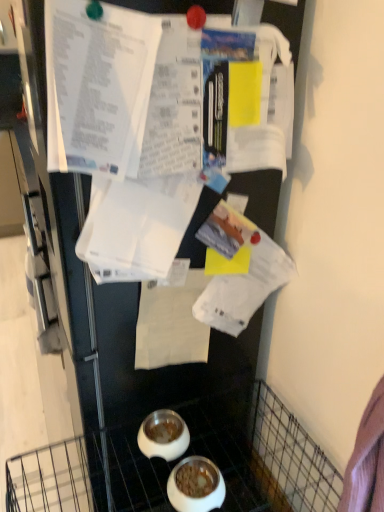
Question: Would you consider white paper at center to be distant from white glossy bowl at lower center, arranged as the 2th bowl when viewed from the back?

Choices:
 (A) yes
 (B) no

Answer: (B)

Question: Is white paper at center to the right of white glossy bowl at lower center, arranged as the 2th bowl when viewed from the back, from the viewer's perspective?

Choices:
 (A) yes
 (B) no

Answer: (B)

Question: Is white paper at center positioned with its back to white glossy bowl at lower center, which ranks as the first bowl in front-to-back order?

Choices:
 (A) no
 (B) yes

Answer: (A)

Question: Is white paper at center surrounding white glossy bowl at lower center, arranged as the 2th bowl when viewed from the back?

Choices:
 (A) no
 (B) yes

Answer: (A)

Question: Can you confirm if white paper at center is shorter than white glossy bowl at lower center, which ranks as the first bowl in front-to-back order?

Choices:
 (A) no
 (B) yes

Answer: (A)

Question: From a real-world perspective, relative to white glossy bowl at lower center, the 1th bowl when ordered from back to front, is white glossy bowl at lower center, arranged as the 2th bowl when viewed from the back, vertically above or below?

Choices:
 (A) above
 (B) below

Answer: (B)

Question: Does point (211, 495) appear closer or farther from the camera than point (153, 426)?

Choices:
 (A) farther
 (B) closer

Answer: (B)

Question: Visually, is white glossy bowl at lower center, arranged as the 2th bowl when viewed from the back, positioned to the left or to the right of white glossy bowl at lower center, the 1th bowl when ordered from back to front?

Choices:
 (A) right
 (B) left

Answer: (A)

Question: Is white glossy bowl at lower center, arranged as the 2th bowl when viewed from the back, in front of or behind white glossy bowl at lower center, the 1th bowl when ordered from back to front, in the image?

Choices:
 (A) front
 (B) behind

Answer: (A)

Question: From the image's perspective, is white glossy bowl at lower center, the 2th bowl from the front, positioned above or below white glossy bowl at lower center, arranged as the 2th bowl when viewed from the back?

Choices:
 (A) above
 (B) below

Answer: (A)

Question: In the image, is white glossy bowl at lower center, the 1th bowl when ordered from back to front, positioned in front of or behind white glossy bowl at lower center, which ranks as the first bowl in front-to-back order?

Choices:
 (A) behind
 (B) front

Answer: (A)

Question: From a real-world perspective, is white glossy bowl at lower center, the 2th bowl from the front, positioned above or below white glossy bowl at lower center, which ranks as the first bowl in front-to-back order?

Choices:
 (A) below
 (B) above

Answer: (B)

Question: Is point (157, 438) positioned closer to the camera than point (215, 477)?

Choices:
 (A) closer
 (B) farther

Answer: (B)

Question: Does point (150, 287) appear closer or farther from the camera than point (155, 421)?

Choices:
 (A) farther
 (B) closer

Answer: (B)

Question: Is white paper at center in front of or behind white glossy bowl at lower center, the 2th bowl from the front, in the image?

Choices:
 (A) front
 (B) behind

Answer: (A)